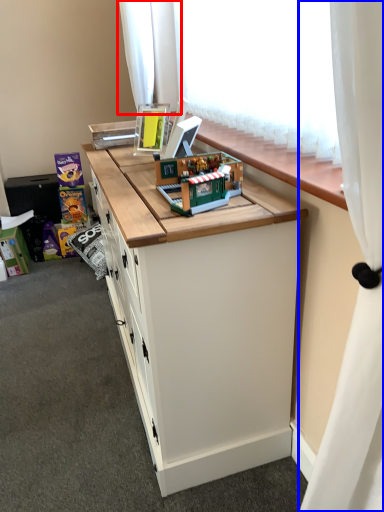
Question: Which of the following is the farthest to the observer, curtain (highlighted by a red box) or curtain (highlighted by a blue box)?

Choices:
 (A) curtain
 (B) curtain

Answer: (A)